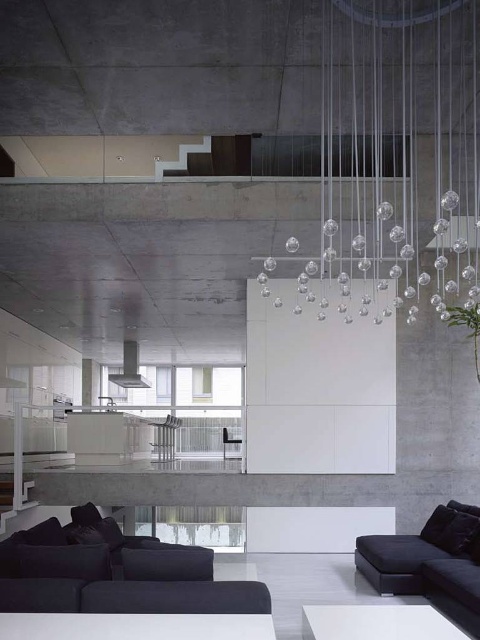
Can you confirm if transparent glass chandelier at upper center is positioned below black leather couch at lower right?

No, transparent glass chandelier at upper center is not below black leather couch at lower right.

Who is more forward, (432, 8) or (383, 580)?

Point (383, 580) is more forward.

At what (x,y) coordinates should I click in order to perform the action: click on transparent glass chandelier at upper center. Please return your answer as a coordinate pair (x, y). This screenshot has width=480, height=640. Looking at the image, I should click on (397, 156).

Which is more to the left, white glossy coffee table at lower center or metallic silver chair at center?

metallic silver chair at center

Which is in front, point (324, 618) or point (223, 435)?

Point (324, 618) is more forward.

Image resolution: width=480 pixels, height=640 pixels. Identify the location of white glossy coffee table at lower center. (376, 621).

Does transparent glass chandelier at upper center appear on the right side of white glossy coffee table at lower center?

Indeed, transparent glass chandelier at upper center is positioned on the right side of white glossy coffee table at lower center.

Does transparent glass chandelier at upper center have a greater height compared to white glossy coffee table at lower center?

Correct, transparent glass chandelier at upper center is much taller as white glossy coffee table at lower center.

Find the location of `transparent glass chandelier at upper center`. transparent glass chandelier at upper center is located at coordinates (397, 156).

I want to click on transparent glass chandelier at upper center, so click(397, 156).